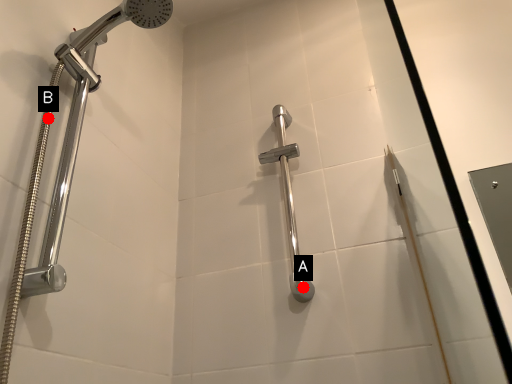
Question: Two points are circled on the image, labeled by A and B beside each circle. Which of the following is the closest to the observer?

Choices:
 (A) A is closer
 (B) B is closer

Answer: (B)